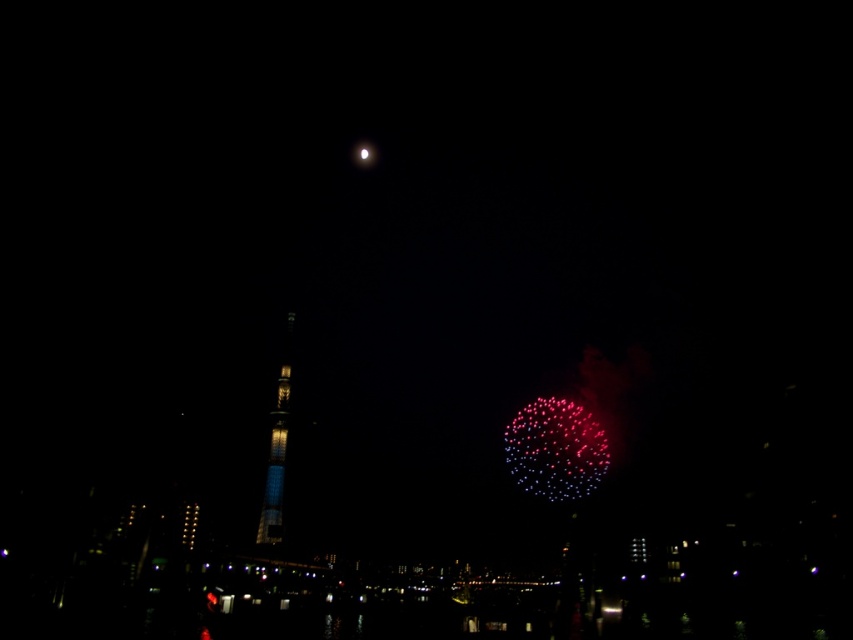
Question: Which object is closer to the camera taking this photo?

Choices:
 (A) shiny glass tower at center
 (B) metallic silver moon at upper center

Answer: (A)

Question: Can you confirm if metallic silver moon at upper center is positioned to the right of shiny glass tower at center?

Choices:
 (A) yes
 (B) no

Answer: (A)

Question: Which of the following is the farthest from the observer?

Choices:
 (A) (578, 435)
 (B) (263, 518)

Answer: (A)

Question: Does metallic silver moon at upper center lie behind shiny glass tower at center?

Choices:
 (A) no
 (B) yes

Answer: (B)

Question: Where is metallic silver moon at upper center located in relation to shiny glass tower at center in the image?

Choices:
 (A) below
 (B) above

Answer: (A)